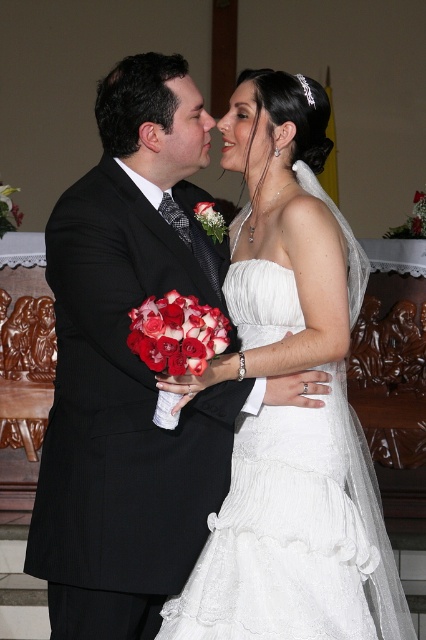
Question: Can you confirm if matte black forehead at upper center is positioned below red silk bouquet at center?

Choices:
 (A) yes
 (B) no

Answer: (B)

Question: Does white satin dress at center appear under matte black forehead at upper center?

Choices:
 (A) yes
 (B) no

Answer: (A)

Question: Which point is closer to the camera taking this photo?

Choices:
 (A) (103, 525)
 (B) (189, 93)
 (C) (298, 516)
 (D) (206, 209)

Answer: (C)

Question: Which object is farther from the camera taking this photo?

Choices:
 (A) red silk bouquet at center
 (B) matte black forehead at upper center
 (C) white satin dress at center

Answer: (A)

Question: Does white satin dress at center have a greater width compared to red silk bouquet at center?

Choices:
 (A) yes
 (B) no

Answer: (A)

Question: Which of the following is the farthest from the observer?

Choices:
 (A) (141, 323)
 (B) (268, 570)
 (C) (218, 218)

Answer: (C)